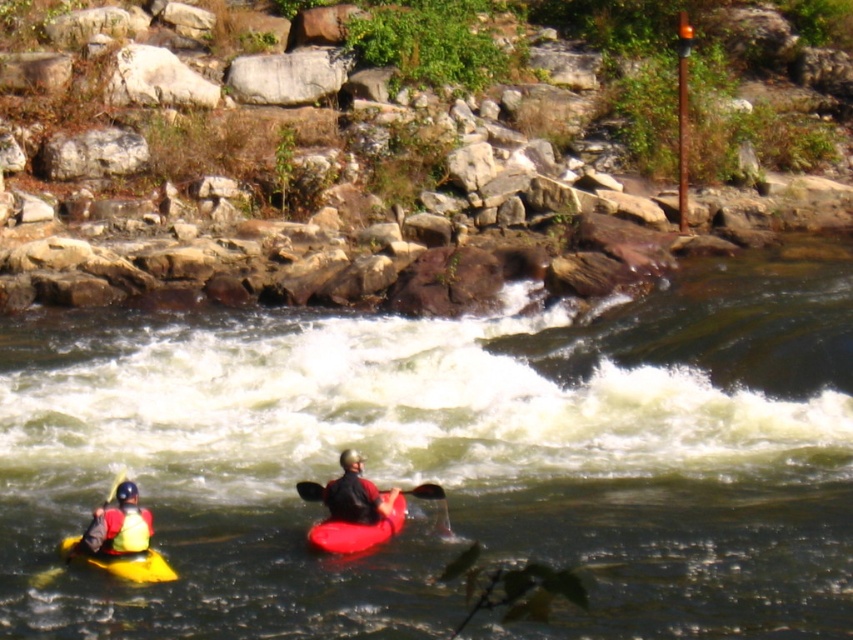
Question: Among these points, which one is nearest to the camera?

Choices:
 (A) (137, 570)
 (B) (138, 538)

Answer: (A)

Question: Is green rubber kayak at center in front of yellow matte life vest at lower left?

Choices:
 (A) yes
 (B) no

Answer: (A)

Question: Which object appears closest to the camera in this image?

Choices:
 (A) smooth black paddle at center
 (B) yellow matte life vest at lower left
 (C) rough textured rocks at upper center

Answer: (B)

Question: Does matte black kayak at center have a greater width compared to smooth black paddle at center?

Choices:
 (A) yes
 (B) no

Answer: (A)

Question: Is yellow matte life vest at lower left below smooth black paddle at center?

Choices:
 (A) no
 (B) yes

Answer: (B)

Question: Which of the following is the farthest from the observer?

Choices:
 (A) (115, 570)
 (B) (340, 545)
 (C) (633, 216)

Answer: (C)